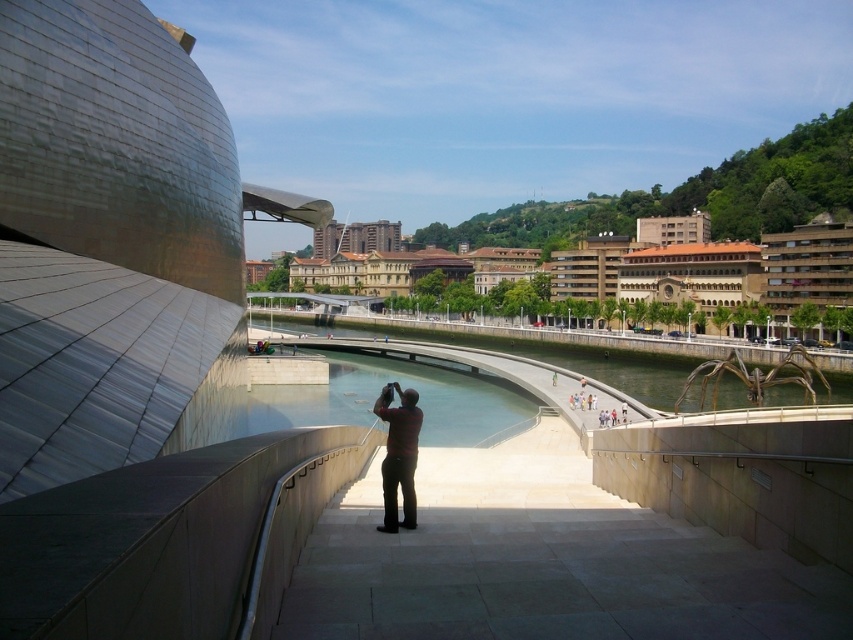
Does clear glass waterway at center have a smaller size compared to dark red shirt at center?

Actually, clear glass waterway at center might be larger than dark red shirt at center.

Describe the element at coordinates (404, 387) in the screenshot. I see `clear glass waterway at center` at that location.

This screenshot has width=853, height=640. Find the location of `clear glass waterway at center`. clear glass waterway at center is located at coordinates (404, 387).

Consider the image. Can you confirm if brown stone buildings at center is bigger than clear glass waterway at center?

Correct, brown stone buildings at center is larger in size than clear glass waterway at center.

The image size is (853, 640). I want to click on brown stone buildings at center, so click(x=711, y=266).

Identify the location of brown stone buildings at center. (711, 266).

Image resolution: width=853 pixels, height=640 pixels. In order to click on brown stone buildings at center in this screenshot , I will do `click(711, 266)`.

Who is more distant from viewer, (701, 289) or (396, 528)?

Positioned behind is point (701, 289).

Find the location of a particular element. brown stone buildings at center is located at coordinates pyautogui.click(x=711, y=266).

Locate an element on the screen. The width and height of the screenshot is (853, 640). brown stone buildings at center is located at coordinates (711, 266).